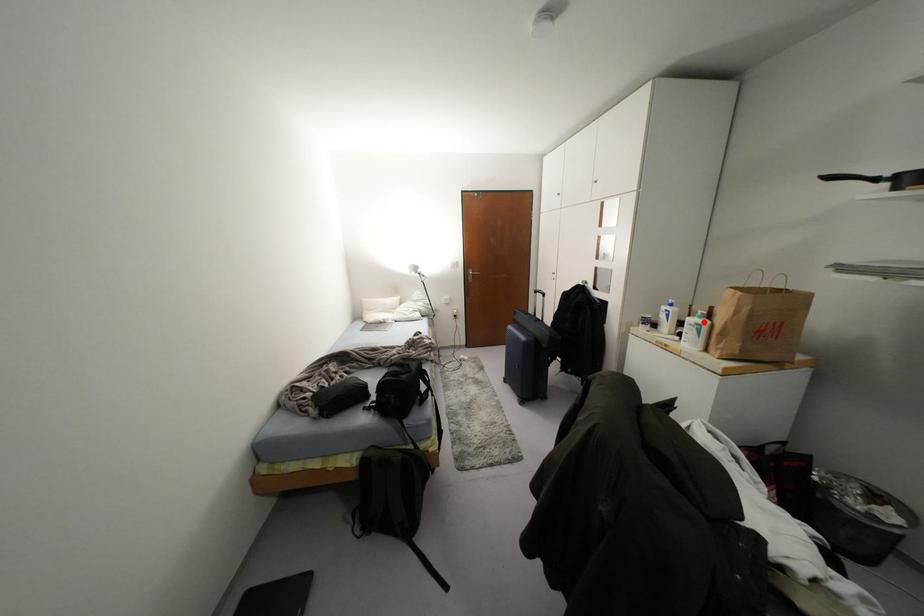
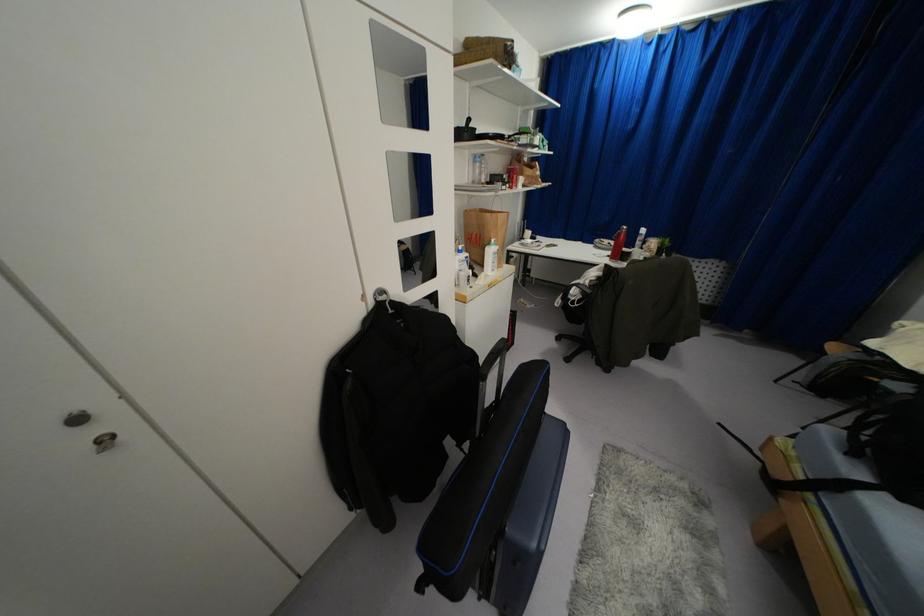
In the second image, find the point that corresponds to the highlighted location in the first image.

(495, 246)